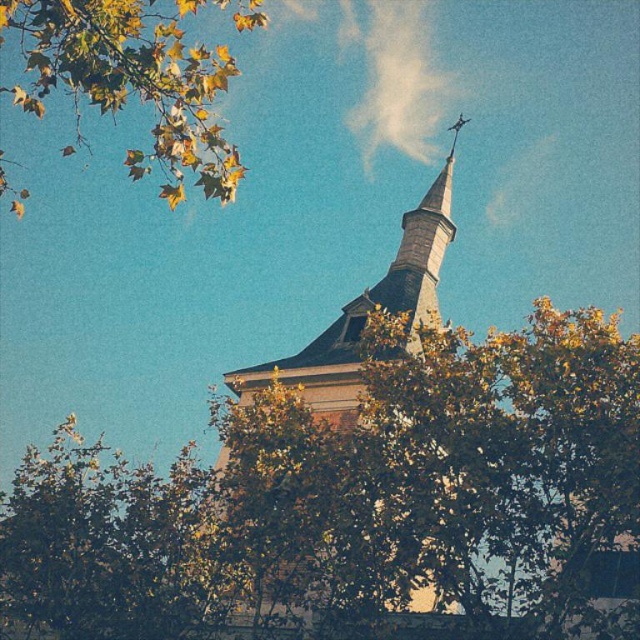
Question: Is yellow-green leaves at upper left behind smooth gray steeple at center?

Choices:
 (A) yes
 (B) no

Answer: (B)

Question: Can you confirm if yellow-green leaves at upper left is smaller than smooth gray steeple at center?

Choices:
 (A) yes
 (B) no

Answer: (B)

Question: Considering the real-world distances, which object is closest to the green leafy tree at center?

Choices:
 (A) smooth gray steeple at center
 (B) yellow-green leaves at upper left

Answer: (A)

Question: Considering the relative positions of yellow-green leaves at upper left and smooth gray steeple at center in the image provided, where is yellow-green leaves at upper left located with respect to smooth gray steeple at center?

Choices:
 (A) right
 (B) left

Answer: (B)

Question: Which object is the closest to the green leafy tree at center?

Choices:
 (A) yellow-green leaves at upper left
 (B) smooth gray steeple at center

Answer: (B)

Question: Which object is the farthest from the yellow-green leaves at upper left?

Choices:
 (A) smooth gray steeple at center
 (B) green leafy tree at center

Answer: (A)